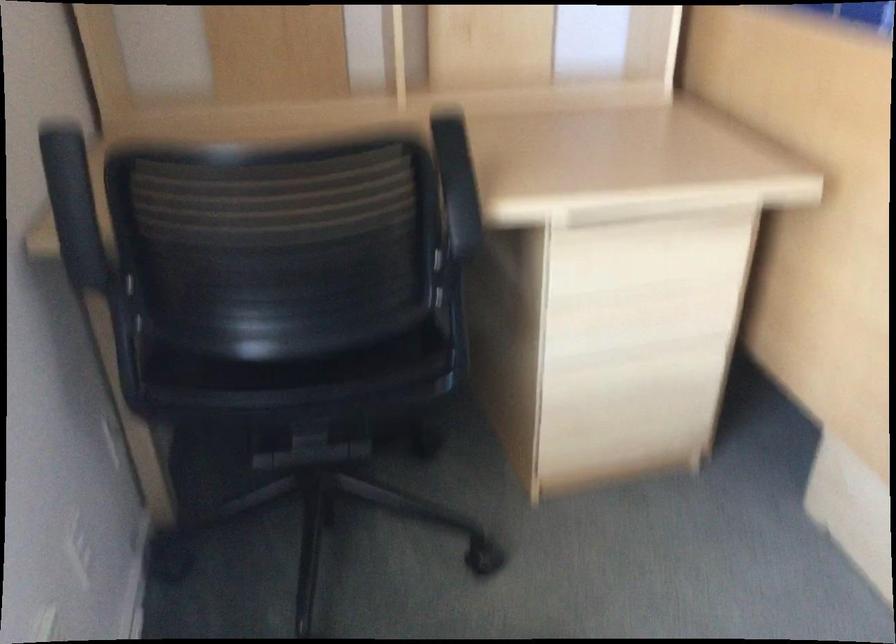
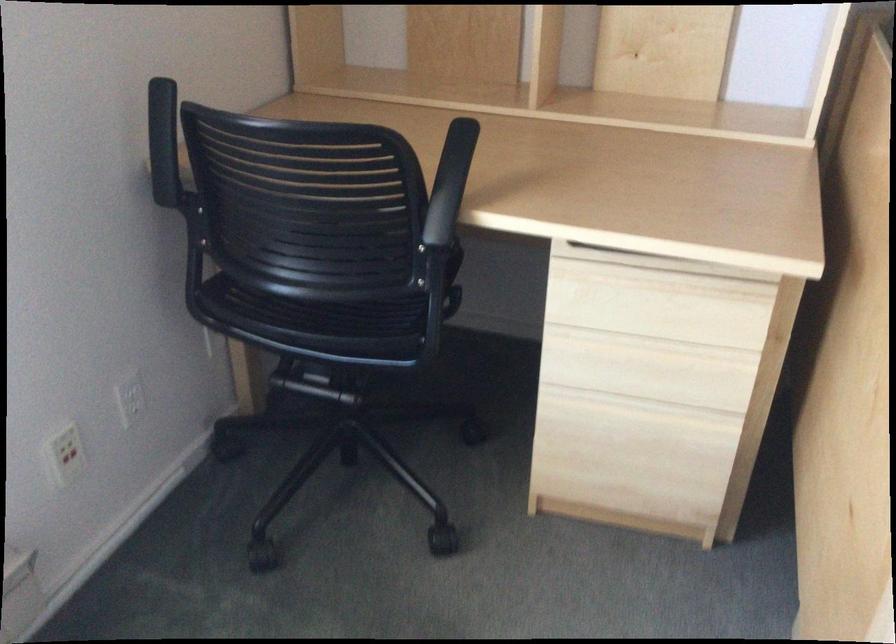
Locate, in the second image, the point that corresponds to point 70,129 in the first image.

(162, 88)